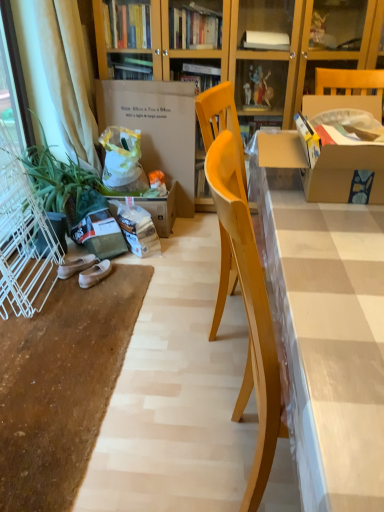
Image resolution: width=384 pixels, height=512 pixels. Describe the element at coordinates (94, 274) in the screenshot. I see `white suede shoes at lower left, which is counted as the 2th footwear, starting from the left` at that location.

Describe the element at coordinates (68, 76) in the screenshot. I see `beige fabric curtain at left` at that location.

The image size is (384, 512). In order to click on white wire screen door at left in this screenshot , I will do `click(23, 234)`.

I want to click on white cardboard box at center, so click(156, 128).

At what (x,y) coordinates should I click in order to perform the action: click on matte cardboard desk at center. Please return your answer as a coordinate pair (x, y). This screenshot has height=512, width=384. Looking at the image, I should click on (327, 334).

Is matte cardboard desk at center in contact with white suede shoes at lower left, which is counted as the 2th footwear, starting from the left?

matte cardboard desk at center is not next to white suede shoes at lower left, which is counted as the 2th footwear, starting from the left, and they're not touching.

Is matte cardboard desk at center in front of or behind white suede shoes at lower left, which is counted as the 2th footwear, starting from the left, in the image?

In the image, matte cardboard desk at center appears in front of white suede shoes at lower left, which is counted as the 2th footwear, starting from the left.

Between beige fabric curtain at left and white suede shoes at lower left, which is counted as the 2th footwear, starting from the left, which one appears on the left side from the viewer's perspective?

beige fabric curtain at left.

Can you confirm if beige fabric curtain at left is taller than white suede shoes at lower left, the 1th footwear positioned from the right?

Indeed, beige fabric curtain at left has a greater height compared to white suede shoes at lower left, the 1th footwear positioned from the right.

Is beige fabric curtain at left directly adjacent to white suede shoes at lower left, which is counted as the 2th footwear, starting from the left?

No, beige fabric curtain at left is not touching white suede shoes at lower left, which is counted as the 2th footwear, starting from the left.

Is white cardboard box at center spatially inside beige fabric curtain at left, or outside of it?

white cardboard box at center is located beyond the bounds of beige fabric curtain at left.

Is white cardboard box at center wider than beige fabric curtain at left?

In fact, white cardboard box at center might be narrower than beige fabric curtain at left.

Identify the location of cardboard box below the beige fabric curtain at left (from the image's perspective). The height and width of the screenshot is (512, 384). (156, 128).

Which of these two, white cardboard box at center or beige fabric curtain at left, is bigger?

beige fabric curtain at left is bigger.

In the image, is white wire screen door at left on the left side or the right side of beige suede shoes at lower left, which is the second footwear from right to left?

Based on their positions, white wire screen door at left is located to the left of beige suede shoes at lower left, which is the second footwear from right to left.

Can you confirm if white wire screen door at left is smaller than beige suede shoes at lower left, which is the second footwear from right to left?

Actually, white wire screen door at left might be larger than beige suede shoes at lower left, which is the second footwear from right to left.

Is white wire screen door at left directly adjacent to beige suede shoes at lower left, which is the second footwear from right to left?

white wire screen door at left is not next to beige suede shoes at lower left, which is the second footwear from right to left, and they're not touching.

From a real-world perspective, is white wire screen door at left above or below beige suede shoes at lower left, acting as the first footwear starting from the left?

From a real-world perspective, white wire screen door at left is physically above beige suede shoes at lower left, acting as the first footwear starting from the left.

From the picture: Which of these two, beige suede shoes at lower left, acting as the first footwear starting from the left, or green matte plant at left, stands taller?

With more height is green matte plant at left.

Locate an element on the screen. The width and height of the screenshot is (384, 512). houseplant in front of the beige suede shoes at lower left, which is the second footwear from right to left is located at coordinates (57, 179).

From the picture: Which is closer, (70, 266) or (58, 205)?

Point (70, 266).

Based on the photo, measure the distance from beige suede shoes at lower left, which is the second footwear from right to left, to green matte plant at left.

A distance of 17.50 inches exists between beige suede shoes at lower left, which is the second footwear from right to left, and green matte plant at left.

From the image's perspective, who appears lower, white cardboard box at center or matte cardboard desk at center?

matte cardboard desk at center.

Is white cardboard box at center inside the boundaries of matte cardboard desk at center, or outside?

white cardboard box at center lies outside matte cardboard desk at center.

Considering the relative sizes of white cardboard box at center and matte cardboard desk at center in the image provided, is white cardboard box at center thinner than matte cardboard desk at center?

Yes.

What's the angular difference between white cardboard box at center and matte cardboard desk at center's facing directions?

The facing directions of white cardboard box at center and matte cardboard desk at center are 89.6 degrees apart.

This screenshot has width=384, height=512. Identify the location of curtain that is above the white wire screen door at left (from a real-world perspective). (68, 76).

From the image's perspective, which one is positioned higher, beige fabric curtain at left or white wire screen door at left?

beige fabric curtain at left, from the image's perspective.

Looking at this image, which object is positioned more to the left, beige fabric curtain at left or white wire screen door at left?

Positioned to the left is white wire screen door at left.

Is beige fabric curtain at left positioned with its back to white wire screen door at left?

Yes, beige fabric curtain at left is facing away from white wire screen door at left.

You are a GUI agent. You are given a task and a screenshot of the screen. Output one action in this format:
    pyautogui.click(x=<x>, y=<y>)
    Task: Click on the 1st footwear behind the matte cardboard desk at center, starting your count from the anchor
    Image resolution: width=384 pixels, height=512 pixels.
    Given the screenshot: What is the action you would take?
    pyautogui.click(x=94, y=274)

At what (x,y) coordinates should I click in order to perform the action: click on curtain above the white suede shoes at lower left, the 1th footwear positioned from the right (from the image's perspective). Please return your answer as a coordinate pair (x, y). Image resolution: width=384 pixels, height=512 pixels. Looking at the image, I should click on (68, 76).

Estimate the real-world distances between objects in this image. Which object is further from matte cardboard desk at center, white suede shoes at lower left, the 1th footwear positioned from the right, or beige fabric curtain at left?

Among the two, beige fabric curtain at left is located further to matte cardboard desk at center.

Looking at this image, when comparing their distances from beige fabric curtain at left, does matte cardboard desk at center or beige suede shoes at lower left, which is the second footwear from right to left, seem further?

matte cardboard desk at center lies further to beige fabric curtain at left than the other object.

When comparing their distances from white cardboard box at center, does white suede shoes at lower left, the 1th footwear positioned from the right, or beige fabric curtain at left seem closer?

The object closer to white cardboard box at center is beige fabric curtain at left.

Estimate the real-world distances between objects in this image. Which object is closer to white wire screen door at left, white suede shoes at lower left, which is counted as the 2th footwear, starting from the left, or white cardboard box at center?

The object closer to white wire screen door at left is white suede shoes at lower left, which is counted as the 2th footwear, starting from the left.

Looking at the image, which one is located closer to green matte plant at left, white wire screen door at left or beige suede shoes at lower left, which is the second footwear from right to left?

white wire screen door at left lies closer to green matte plant at left than the other object.

In the scene shown: From the image, which object appears to be farther from matte cardboard desk at center, beige suede shoes at lower left, acting as the first footwear starting from the left, or green matte plant at left?

Based on the image, beige suede shoes at lower left, acting as the first footwear starting from the left, appears to be further to matte cardboard desk at center.

Which object lies further to the anchor point green matte plant at left, white suede shoes at lower left, the 1th footwear positioned from the right, or matte cardboard desk at center?

matte cardboard desk at center is further to green matte plant at left.

Estimate the real-world distances between objects in this image. Which object is further from beige fabric curtain at left, green matte plant at left or white wire screen door at left?

Among the two, white wire screen door at left is located further to beige fabric curtain at left.

I want to click on houseplant between beige fabric curtain at left and beige suede shoes at lower left, which is the second footwear from right to left, in the up-down direction, so click(57, 179).

At what (x,y) coordinates should I click in order to perform the action: click on screen door between beige fabric curtain at left and beige suede shoes at lower left, acting as the first footwear starting from the left, vertically. Please return your answer as a coordinate pair (x, y). The image size is (384, 512). Looking at the image, I should click on (23, 234).

The height and width of the screenshot is (512, 384). I want to click on curtain located between white wire screen door at left and white cardboard box at center in the depth direction, so click(x=68, y=76).

What are the coordinates of `screen door between matte cardboard desk at center and beige suede shoes at lower left, which is the second footwear from right to left, in the front-back direction` in the screenshot? It's located at (23, 234).